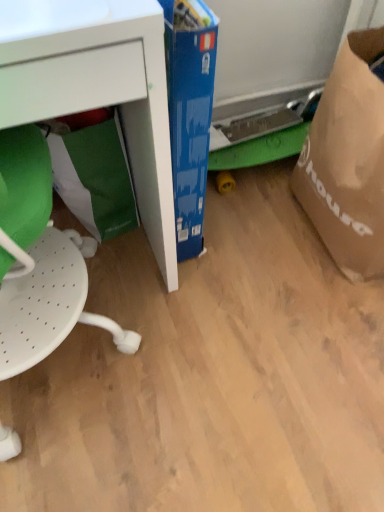
Where is `free point to the right of white matte desk at lower left`? The width and height of the screenshot is (384, 512). free point to the right of white matte desk at lower left is located at coordinates (241, 283).